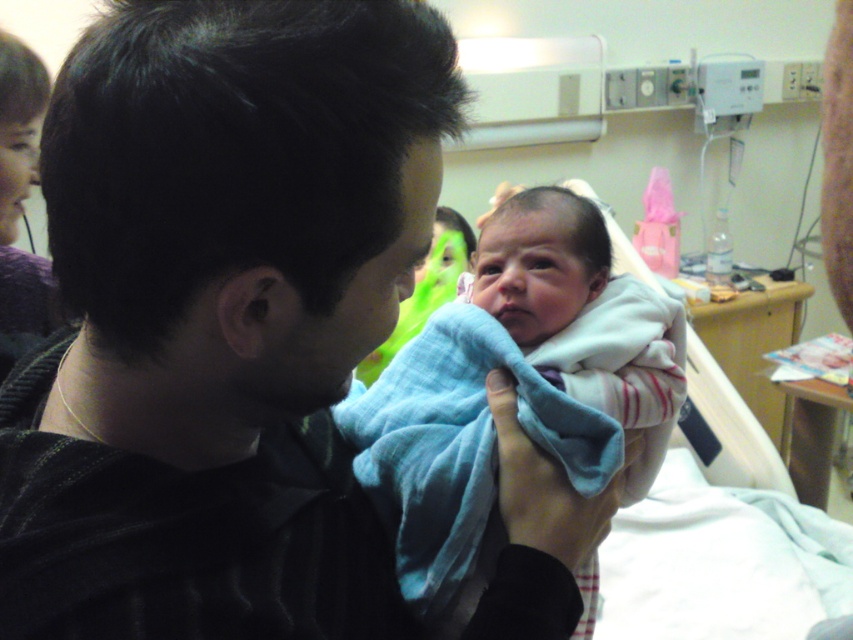
Does black sweater at center have a greater width compared to soft blue blanket at center?

Yes.

Is point (297, 378) in front of point (339, 417)?

Yes.

This screenshot has width=853, height=640. Find the location of `black sweater at center`. black sweater at center is located at coordinates (219, 317).